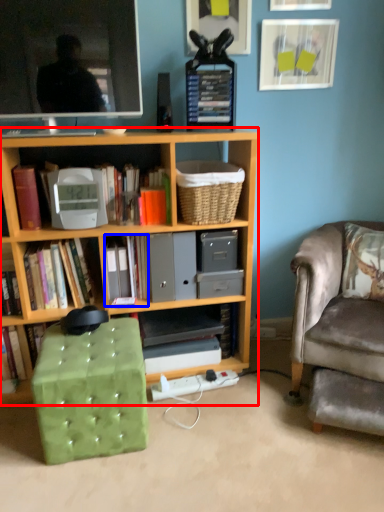
Question: Which object appears closest to the camera in this image, bookcase (highlighted by a red box) or book (highlighted by a blue box)?

Choices:
 (A) bookcase
 (B) book

Answer: (A)